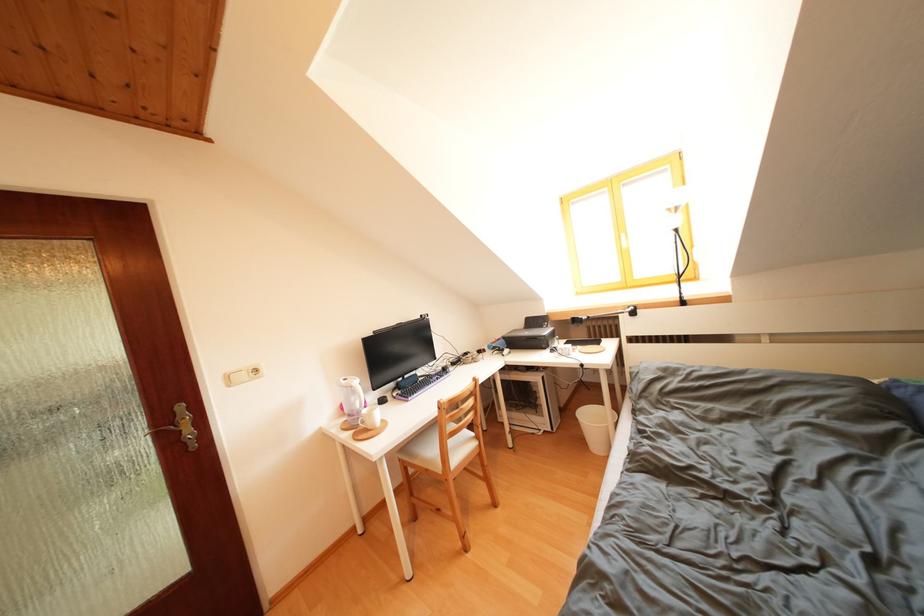
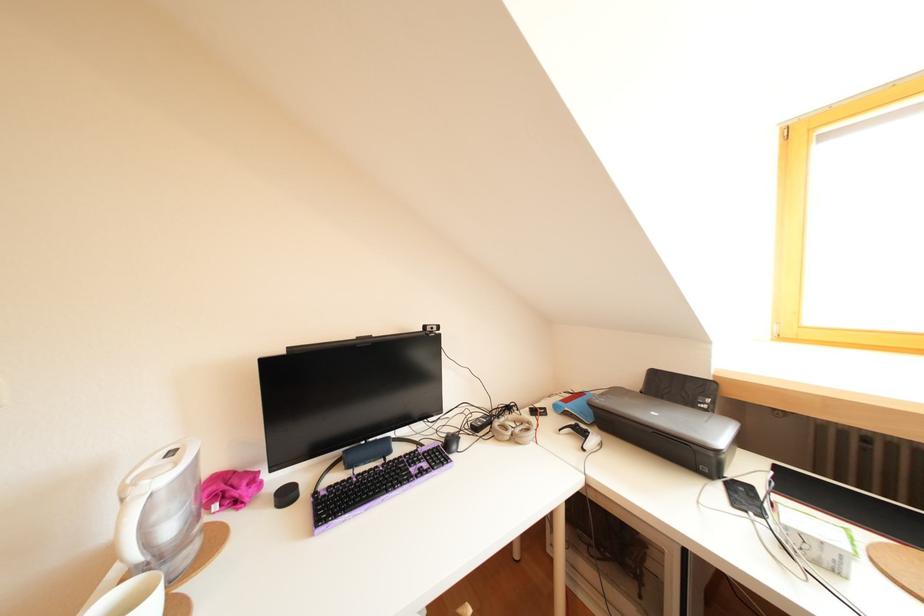
Find the pixel in the second image that matches point (473, 359) in the first image.

(516, 413)